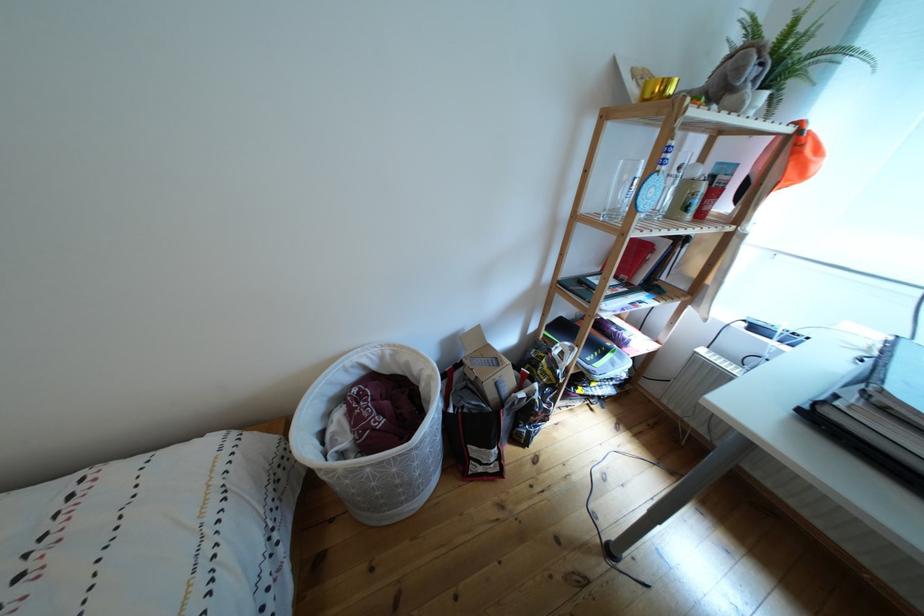
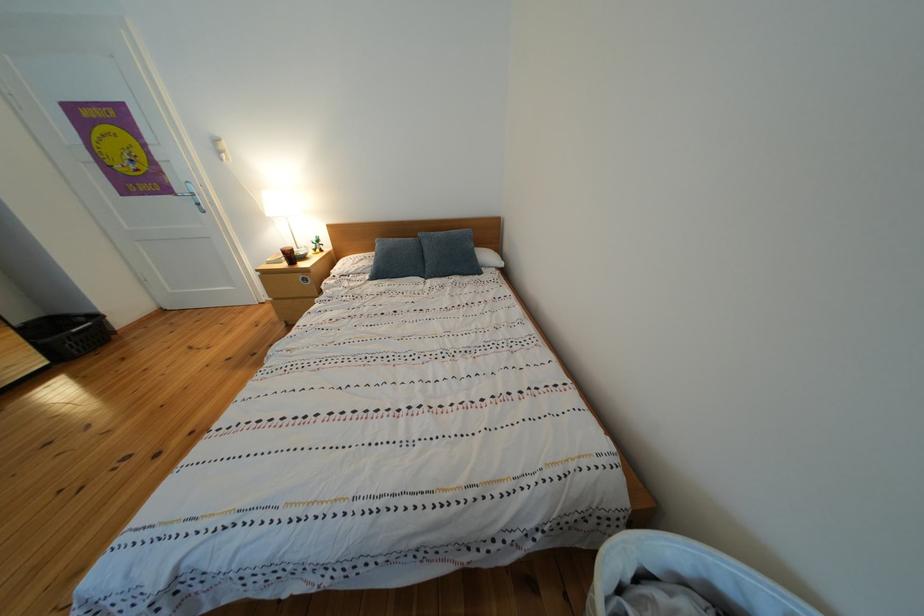
The images are taken continuously from a first-person perspective. In which direction is your viewpoint rotating?

The rotation direction of the camera is left-down.